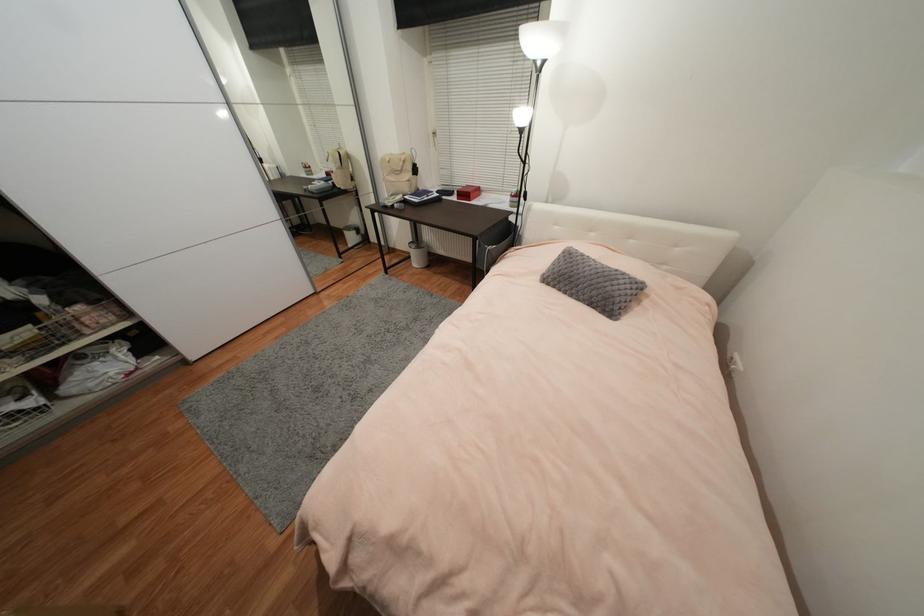
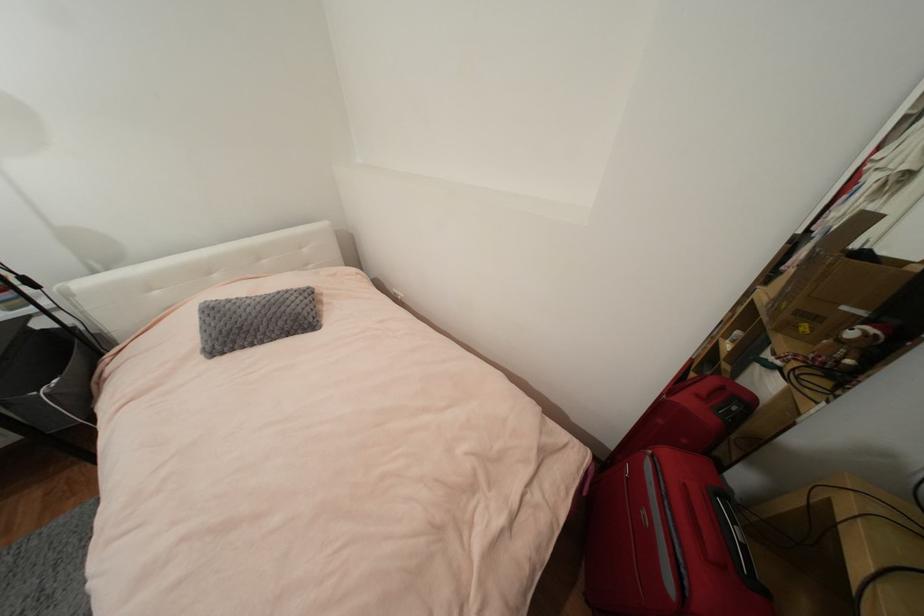
Based on the continuous images, in which direction is the camera rotating?

The camera rotated toward right-down.